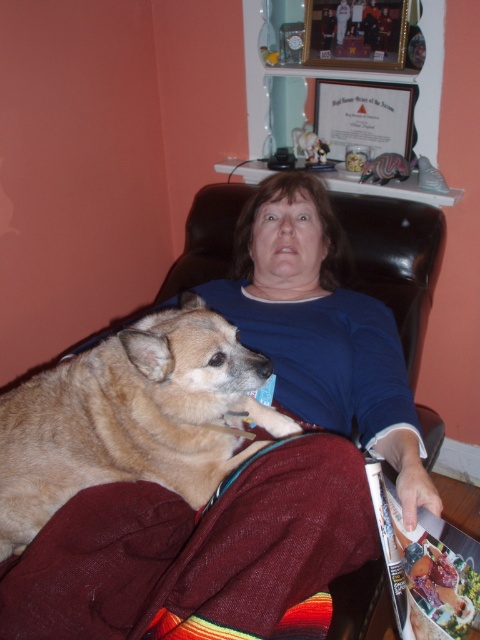
Question: Where is burgundy fleece blanket at lower left located in relation to light brown fur at center in the image?

Choices:
 (A) right
 (B) left

Answer: (A)

Question: Which point is farther to the camera?

Choices:
 (A) burgundy fleece blanket at lower left
 (B) matte plastic magazine at lower right

Answer: (B)

Question: Which object is closer to the camera taking this photo?

Choices:
 (A) burgundy fleece blanket at lower left
 (B) matte plastic magazine at lower right
 (C) light brown fur at center

Answer: (A)

Question: Based on their relative distances, which object is nearer to the matte plastic magazine at lower right?

Choices:
 (A) light brown fur at center
 (B) burgundy fleece blanket at lower left
 (C) blue cotton shirt at upper center

Answer: (B)

Question: Does burgundy fleece blanket at lower left come behind matte plastic magazine at lower right?

Choices:
 (A) no
 (B) yes

Answer: (A)

Question: Can you confirm if blue cotton shirt at upper center is wider than matte plastic magazine at lower right?

Choices:
 (A) no
 (B) yes

Answer: (B)